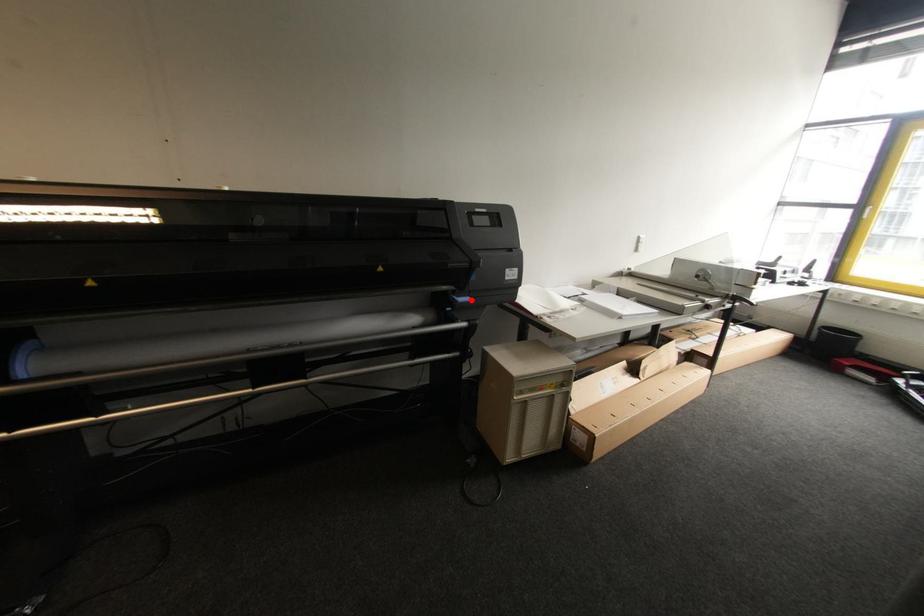
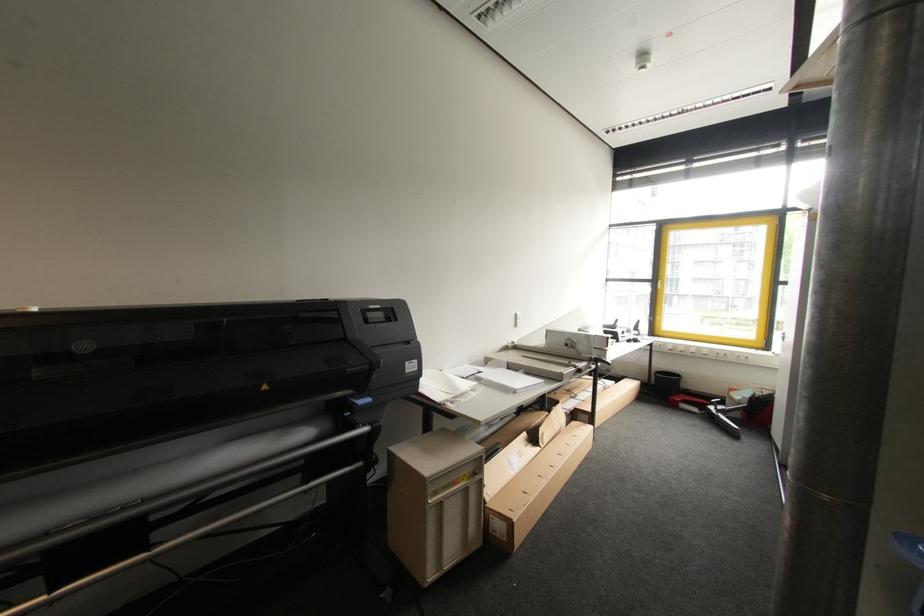
Locate, in the second image, the point that corresponds to the highlighted location in the first image.

(371, 400)